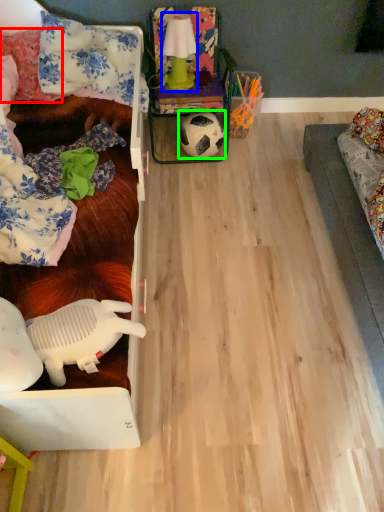
Question: Which object is positioned farthest from pillow (highlighted by a red box)? Select from lamp (highlighted by a blue box) and football (highlighted by a green box).

Choices:
 (A) lamp
 (B) football

Answer: (B)